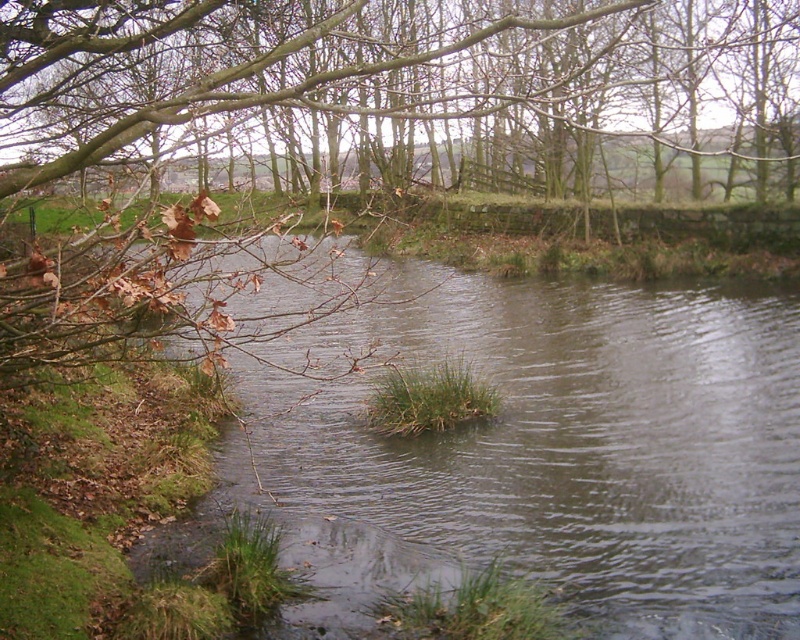
Question: Can you confirm if brown leafy branches at upper left is positioned below clear water at center?

Choices:
 (A) yes
 (B) no

Answer: (B)

Question: In this image, where is brown leafy branches at upper left located relative to clear water at center?

Choices:
 (A) left
 (B) right

Answer: (A)

Question: Observing the image, what is the correct spatial positioning of brown leafy branches at upper left in reference to clear water at center?

Choices:
 (A) below
 (B) above

Answer: (B)

Question: Which object is closer to the camera taking this photo?

Choices:
 (A) brown leafy branches at upper left
 (B) clear water at center

Answer: (A)